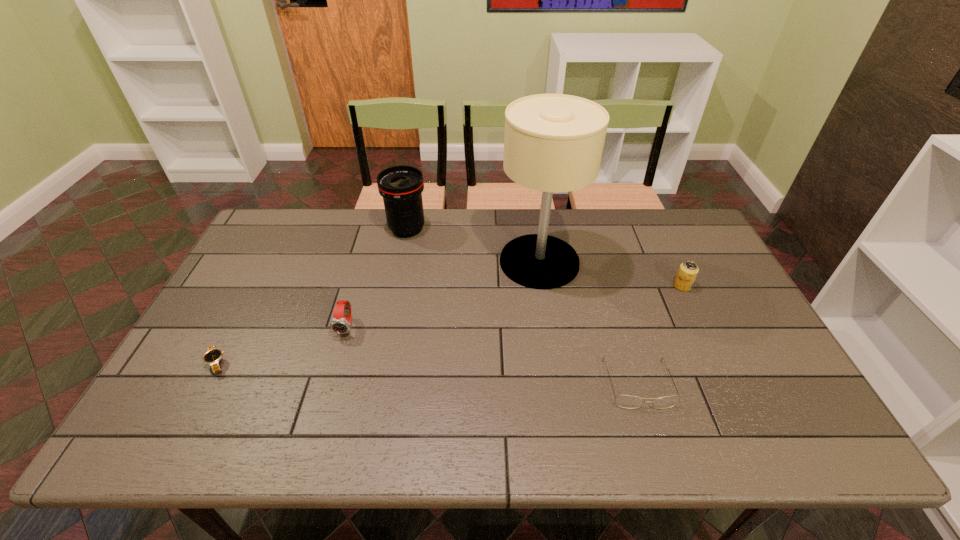
Find the location of `vacant space at the near edge of the desktop`. vacant space at the near edge of the desktop is located at coordinates pos(684,422).

The height and width of the screenshot is (540, 960). In the image, there is a desktop. What are the coordinates of `free region at the left edge` in the screenshot? It's located at (247, 291).

I want to click on free space at the right edge, so click(706, 264).

You are a GUI agent. You are given a task and a screenshot of the screen. Output one action in this format:
    pyautogui.click(x=<x>, y=<y>)
    Task: Click on the vacant space at the far left corner of the desktop
    
    Given the screenshot: What is the action you would take?
    pyautogui.click(x=267, y=229)

Locate an element on the screen. blank area at the near left corner is located at coordinates (197, 429).

In the image, there is a desktop. At what (x,y) coordinates should I click in order to perform the action: click on vacant space at the far right corner. Please return your answer as a coordinate pair (x, y). The width and height of the screenshot is (960, 540). Looking at the image, I should click on coord(681,238).

The image size is (960, 540). I want to click on free space between the rightmost object and the nearer watch, so click(x=449, y=325).

In order to click on free space between the fifth object from right to left and the second tallest object in this screenshot , I will do `click(377, 278)`.

Find the location of a particular element. The image size is (960, 540). vacant space in between the shorter watch and the fifth tallest object is located at coordinates (428, 374).

Find the location of `empty space between the table lamp and the left watch`. empty space between the table lamp and the left watch is located at coordinates (378, 313).